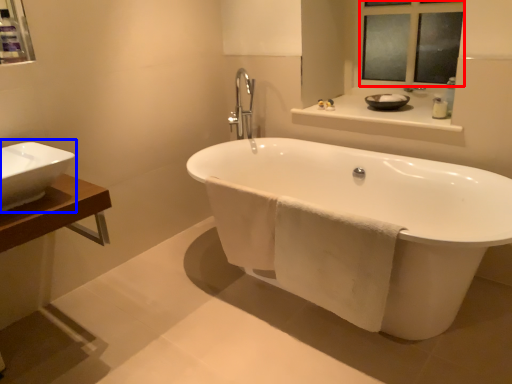
Question: Among these objects, which one is farthest to the camera, mirror (highlighted by a red box) or sink (highlighted by a blue box)?

Choices:
 (A) mirror
 (B) sink

Answer: (A)